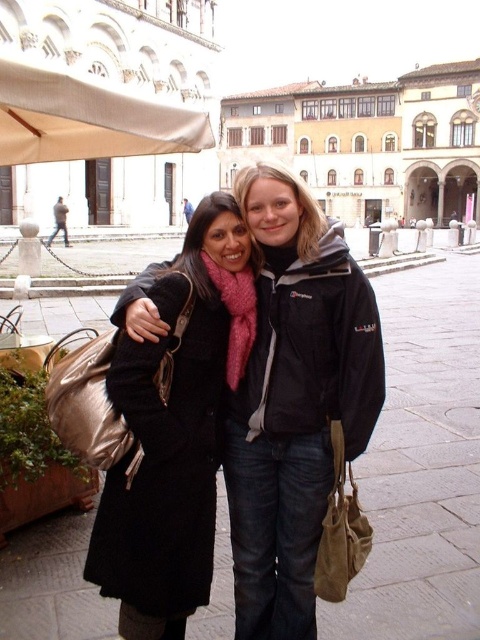
Question: Which object is positioned closest to the beige fabric canopy at upper left?

Choices:
 (A) black matte jacket at center
 (B) black wool coat at center

Answer: (B)

Question: Does black wool coat at center have a lesser width compared to beige fabric canopy at upper left?

Choices:
 (A) yes
 (B) no

Answer: (A)

Question: Is black matte jacket at center further to camera compared to black wool coat at center?

Choices:
 (A) no
 (B) yes

Answer: (B)

Question: Can you confirm if black matte jacket at center is smaller than beige fabric canopy at upper left?

Choices:
 (A) no
 (B) yes

Answer: (A)

Question: Which object is farther from the camera taking this photo?

Choices:
 (A) beige fabric canopy at upper left
 (B) black matte jacket at center
 (C) black wool coat at center

Answer: (A)

Question: Which point is farther to the camera?

Choices:
 (A) (232, 321)
 (B) (58, 88)
 (C) (248, 579)

Answer: (A)